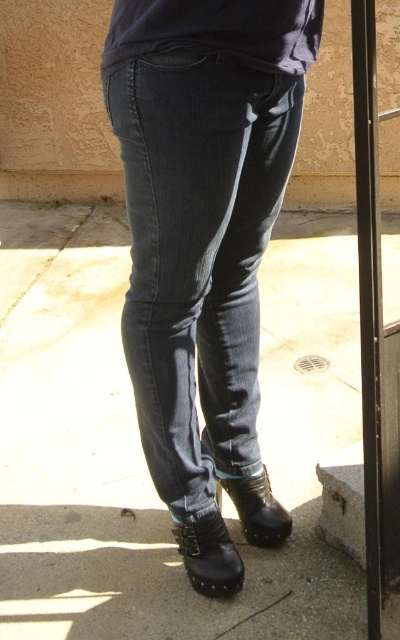
Question: Does gray concrete pavement at lower center lie behind dark blue denim jeans at center?

Choices:
 (A) no
 (B) yes

Answer: (B)

Question: Which of the following is the closest to the observer?

Choices:
 (A) dark blue denim jeans at center
 (B) gray concrete pavement at lower center

Answer: (A)

Question: Does gray concrete pavement at lower center have a smaller size compared to dark blue denim jeans at center?

Choices:
 (A) no
 (B) yes

Answer: (A)

Question: Can you confirm if gray concrete pavement at lower center is thinner than dark blue denim jeans at center?

Choices:
 (A) no
 (B) yes

Answer: (A)